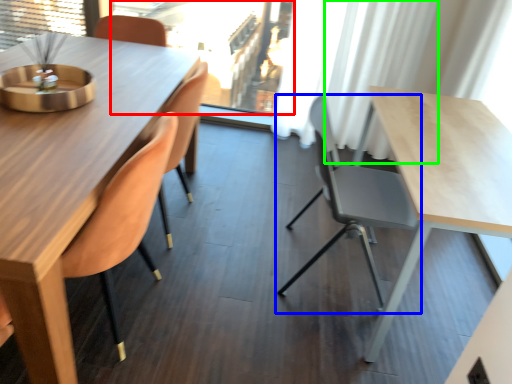
Question: Based on their relative distances, which object is nearer to window screen (highlighted by a red box)? Choose from chair (highlighted by a blue box) and curtain (highlighted by a green box).

Choices:
 (A) chair
 (B) curtain

Answer: (B)